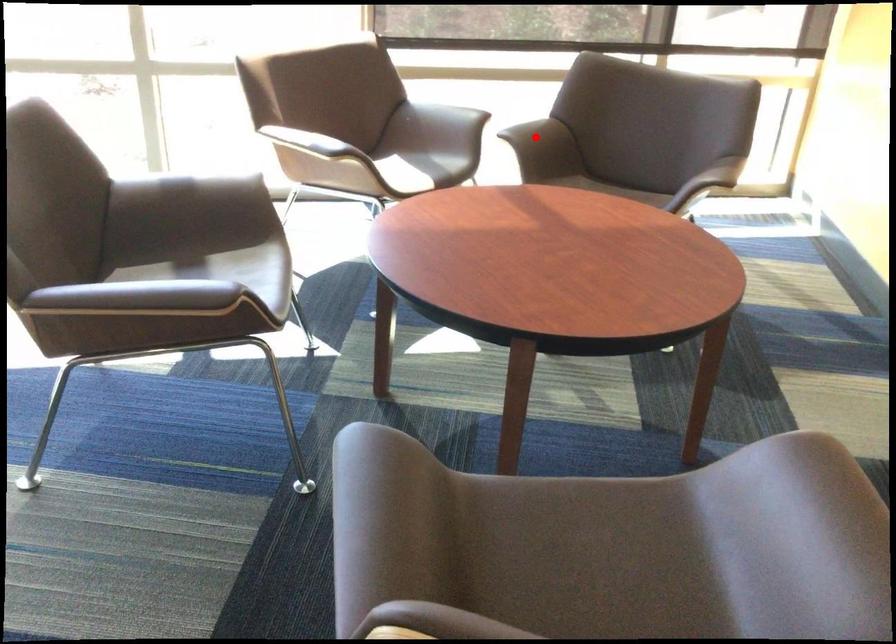
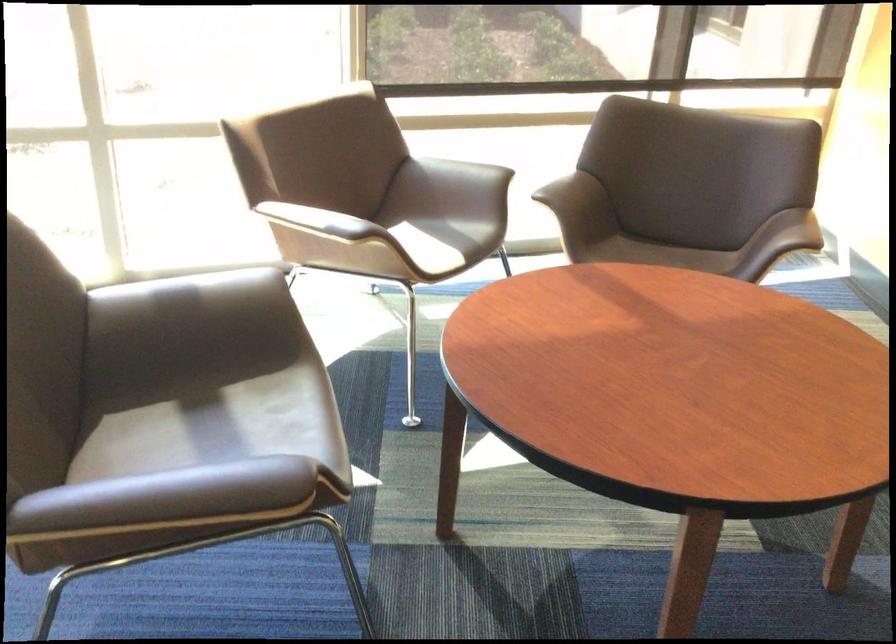
The point at the highlighted location is marked in the first image. Where is the corresponding point in the second image?

(574, 196)